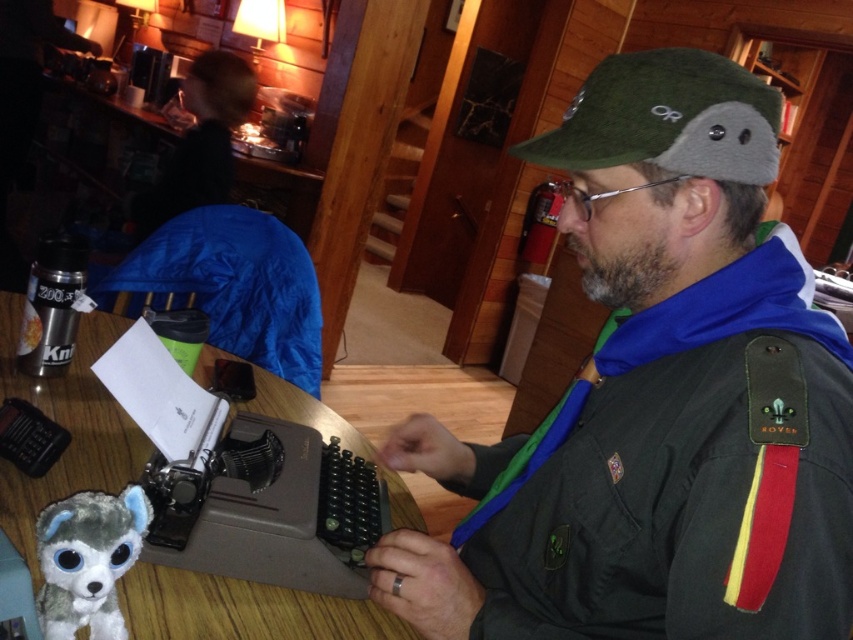
You are a guest in this cabin and want to place a small gift on the wooden table at center. However, there is a green fabric cap at upper right nearby. Where should you place the gift so it doesn not interfere with the cap?

Place the gift to the left of the wooden table at center since the green fabric cap at upper right is located to the right of it, so placing the gift on the left side would avoid interference with the cap.

What object is located at the coordinates point (656, 400)?

The green fabric cap at upper right is located at point (656, 400).